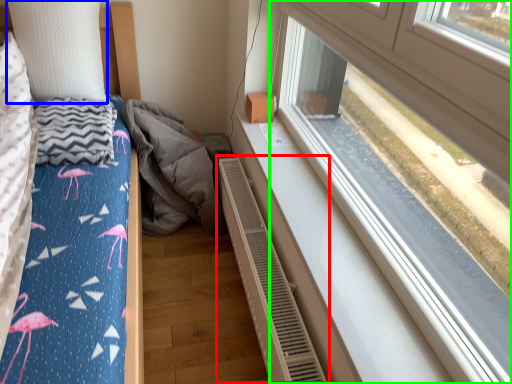
Question: Which object is positioned farthest from air conditioner (highlighted by a red box)? Select from pillow (highlighted by a blue box) and window (highlighted by a green box).

Choices:
 (A) pillow
 (B) window

Answer: (A)